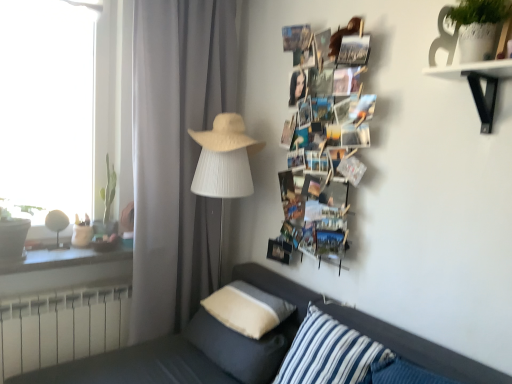
The width and height of the screenshot is (512, 384). What do you see at coordinates (325, 120) in the screenshot?
I see `printed paper collage at upper right` at bounding box center [325, 120].

Locate an element on the screen. The height and width of the screenshot is (384, 512). matte wood window sill at left is located at coordinates (66, 258).

In order to click on soft beige pillow at lower center, positioned as the 2th pillow in front-to-back order in this screenshot , I will do `click(241, 347)`.

Describe the element at coordinates (226, 135) in the screenshot. I see `beige woven fedora at center` at that location.

Identify the location of printed paper collage at upper right. This screenshot has width=512, height=384. (325, 120).

Considering the relative sizes of gray matte curtain at center and soft beige pillow at lower center, the second pillow when ordered from back to front, in the image provided, is gray matte curtain at center taller than soft beige pillow at lower center, the second pillow when ordered from back to front,?

Yes.

How many degrees apart are the facing directions of gray matte curtain at center and soft beige pillow at lower center, the second pillow when ordered from back to front?

The angle between the facing direction of gray matte curtain at center and the facing direction of soft beige pillow at lower center, the second pillow when ordered from back to front, is 93.9 degrees.

Is gray matte curtain at center facing towards soft beige pillow at lower center, positioned as the 2th pillow in front-to-back order?

Yes, gray matte curtain at center is aimed at soft beige pillow at lower center, positioned as the 2th pillow in front-to-back order.

Considering the relative sizes of gray matte curtain at center and soft beige pillow at lower center, positioned as the 2th pillow in front-to-back order, in the image provided, is gray matte curtain at center bigger than soft beige pillow at lower center, positioned as the 2th pillow in front-to-back order,?

Yes, gray matte curtain at center is bigger than soft beige pillow at lower center, positioned as the 2th pillow in front-to-back order.

Is beige woven fedora at center next to white fabric lampshade at center, marked as the first table lamp in a right-to-left arrangement?

beige woven fedora at center and white fabric lampshade at center, marked as the first table lamp in a right-to-left arrangement, are not in contact.

Identify the location of table lamp that is the 1st one when counting leftward from the beige woven fedora at center. The height and width of the screenshot is (384, 512). (222, 180).

Is beige woven fedora at center spatially inside white fabric lampshade at center, marked as the first table lamp in a right-to-left arrangement, or outside of it?

beige woven fedora at center lies outside white fabric lampshade at center, marked as the first table lamp in a right-to-left arrangement.

From the image's perspective, between beige woven fedora at center and white fabric lampshade at center, acting as the 2th table lamp starting from the left, who is located below?

white fabric lampshade at center, acting as the 2th table lamp starting from the left.

From the image's perspective, is white metallic radiator at lower left located above printed paper collage at upper right?

No, from the image's perspective, white metallic radiator at lower left is not over printed paper collage at upper right.

From a real-world perspective, which is physically below, white metallic radiator at lower left or printed paper collage at upper right?

From a 3D spatial view, white metallic radiator at lower left is below.

Based on the photo, in the image, is white metallic radiator at lower left positioned in front of or behind printed paper collage at upper right?

white metallic radiator at lower left is behind printed paper collage at upper right.

Does point (120, 288) come farther from viewer compared to point (328, 194)?

Yes, point (120, 288) is behind point (328, 194).

Is soft beige pillow at lower center, the second pillow when ordered from back to front, wider or thinner than gray matte curtain at center?

→ In the image, soft beige pillow at lower center, the second pillow when ordered from back to front, appears to be wider than gray matte curtain at center.

Is soft beige pillow at lower center, positioned as the 2th pillow in front-to-back order, surrounding gray matte curtain at center?

Definitely not — gray matte curtain at center is not inside soft beige pillow at lower center, positioned as the 2th pillow in front-to-back order.

From the image's perspective, which one is positioned higher, soft beige pillow at lower center, the second pillow when ordered from back to front, or gray matte curtain at center?

gray matte curtain at center appears higher in the image.

Are beige woven fedora at center and matte wood window sill at left beside each other?

There is a gap between beige woven fedora at center and matte wood window sill at left.

How different are the orientations of beige woven fedora at center and matte wood window sill at left in degrees?

The angular difference between beige woven fedora at center and matte wood window sill at left is 85.2 degrees.

Is beige woven fedora at center positioned with its back to matte wood window sill at left?

No.

Is beige woven fedora at center to the right of matte wood window sill at left from the viewer's perspective?

Yes, beige woven fedora at center is to the right of matte wood window sill at left.

Looking at this image, choose the correct answer: Is dark gray fabric couch at lower left inside matte wood window sill at left or outside it?

dark gray fabric couch at lower left lies outside matte wood window sill at left.

Is point (155, 359) positioned in front of point (56, 263)?

Yes.

Is the surface of dark gray fabric couch at lower left in direct contact with matte wood window sill at left?

No, dark gray fabric couch at lower left is not next to matte wood window sill at left.

From the image's perspective, which object appears higher, dark gray fabric couch at lower left or matte wood window sill at left?

matte wood window sill at left appears higher in the image.

Considering the relative positions of printed paper collage at upper right and dark gray fabric couch at lower left in the image provided, is printed paper collage at upper right to the left of dark gray fabric couch at lower left from the viewer's perspective?

No.

Does printed paper collage at upper right have a greater height compared to dark gray fabric couch at lower left?

Indeed, printed paper collage at upper right has a greater height compared to dark gray fabric couch at lower left.

Considering the points (332, 97) and (361, 329), which point is behind, point (332, 97) or point (361, 329)?

The point (332, 97) is more distant.

From the picture: Which of these two, printed paper collage at upper right or dark gray fabric couch at lower left, is smaller?

printed paper collage at upper right is smaller.

This screenshot has width=512, height=384. In order to click on curtain on the left of soft beige pillow at lower center, the second pillow when ordered from back to front in this screenshot , I will do pyautogui.click(x=176, y=155).

You are a GUI agent. You are given a task and a screenshot of the screen. Output one action in this format:
    pyautogui.click(x=<x>, y=<y>)
    Task: Click on the fedora located in front of the white fabric lampshade at center, acting as the 2th table lamp starting from the left
    
    Given the screenshot: What is the action you would take?
    pyautogui.click(x=226, y=135)

From the image, which object appears to be farther from matte wood window sill at left, gray matte curtain at center or white cotton pillow at lower center, which is the third pillow in front-to-back order?

white cotton pillow at lower center, which is the third pillow in front-to-back order, lies further to matte wood window sill at left than the other object.

Looking at the image, which one is located closer to gray matte curtain at center, beige woven fedora at center or soft beige pillow at lower center, positioned as the 2th pillow in front-to-back order?

The object closer to gray matte curtain at center is beige woven fedora at center.

In the scene shown: Estimate the real-world distances between objects in this image. Which object is closer to white fabric lampshade at center, marked as the first table lamp in a right-to-left arrangement, soft beige pillow at lower center, positioned as the 2th pillow in front-to-back order, or white cotton pillow at lower center, which is the third pillow in front-to-back order?

Based on the image, white cotton pillow at lower center, which is the third pillow in front-to-back order, appears to be nearer to white fabric lampshade at center, marked as the first table lamp in a right-to-left arrangement.

Looking at the image, which one is located further to gray matte curtain at center, dark gray fabric couch at lower left or matte white table lamp at left, placed as the 1th table lamp when sorted from left to right?

Among the two, dark gray fabric couch at lower left is located further to gray matte curtain at center.

Looking at the image, which one is located further to beige woven fedora at center, white fabric lampshade at center, marked as the first table lamp in a right-to-left arrangement, or matte white table lamp at left, placed as the 1th table lamp when sorted from left to right?

The object further to beige woven fedora at center is matte white table lamp at left, placed as the 1th table lamp when sorted from left to right.

Looking at the image, which one is located closer to matte wood window sill at left, white metallic radiator at lower left or matte white table lamp at left, which is the 2th table lamp in right-to-left order?

The object closer to matte wood window sill at left is matte white table lamp at left, which is the 2th table lamp in right-to-left order.

Looking at the image, which one is located further to dark gray fabric couch at lower left, soft beige pillow at lower center, the second pillow when ordered from back to front, or beige woven fedora at center?

beige woven fedora at center.

When comparing their distances from printed paper collage at upper right, does matte white table lamp at left, placed as the 1th table lamp when sorted from left to right, or blue striped pillow at lower center, acting as the 1th pillow starting from the front, seem further?

matte white table lamp at left, placed as the 1th table lamp when sorted from left to right, lies further to printed paper collage at upper right than the other object.

Locate an element on the screen. This screenshot has height=384, width=512. table lamp positioned between dark gray fabric couch at lower left and white fabric lampshade at center, acting as the 2th table lamp starting from the left, from near to far is located at coordinates pos(57,226).

You are a GUI agent. You are given a task and a screenshot of the screen. Output one action in this format:
    pyautogui.click(x=<x>, y=<y>)
    Task: Click on the curtain located between matte white table lamp at left, which is the 2th table lamp in right-to-left order, and white cotton pillow at lower center, the first pillow viewed from the back, in the left-right direction
    
    Given the screenshot: What is the action you would take?
    pyautogui.click(x=176, y=155)

At what (x,y) coordinates should I click in order to perform the action: click on radiator situated between matte wood window sill at left and soft beige pillow at lower center, positioned as the 2th pillow in front-to-back order, from left to right. Please return your answer as a coordinate pair (x, y). Looking at the image, I should click on (62, 328).

You are a GUI agent. You are given a task and a screenshot of the screen. Output one action in this format:
    pyautogui.click(x=<x>, y=<y>)
    Task: Click on the curtain between beige woven fedora at center and blue striped pillow at lower center, placed as the 3th pillow when sorted from back to front, in the vertical direction
    Image resolution: width=512 pixels, height=384 pixels.
    Given the screenshot: What is the action you would take?
    pyautogui.click(x=176, y=155)